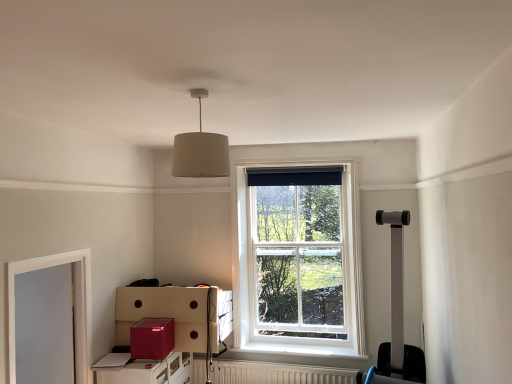
This screenshot has height=384, width=512. Find the location of `empty space that is ontop of white textured radiator at lower center (from a real-world perspective)`. empty space that is ontop of white textured radiator at lower center (from a real-world perspective) is located at coordinates (279, 362).